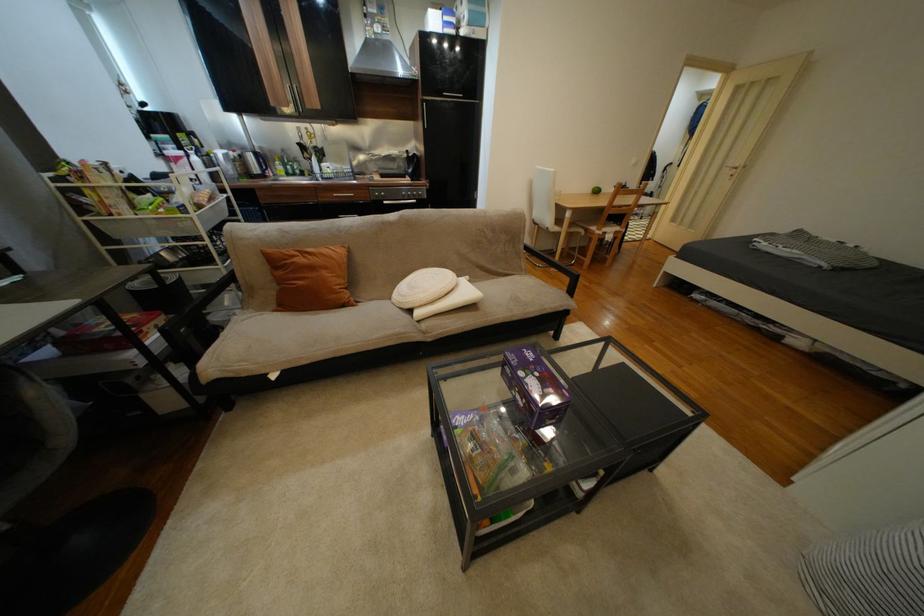
Image resolution: width=924 pixels, height=616 pixels. Describe the element at coordinates (431, 108) in the screenshot. I see `a black refrigerator handle` at that location.